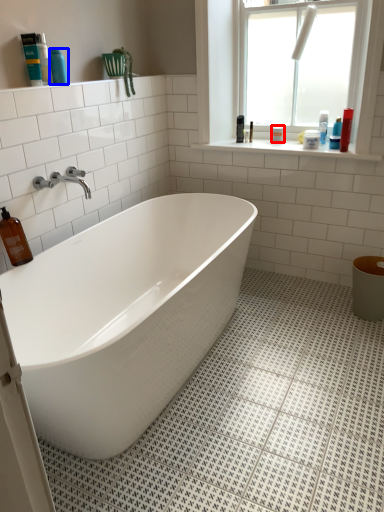
Question: Which of the following is the farthest to the observer, toiletry (highlighted by a red box) or toiletry (highlighted by a blue box)?

Choices:
 (A) toiletry
 (B) toiletry

Answer: (A)